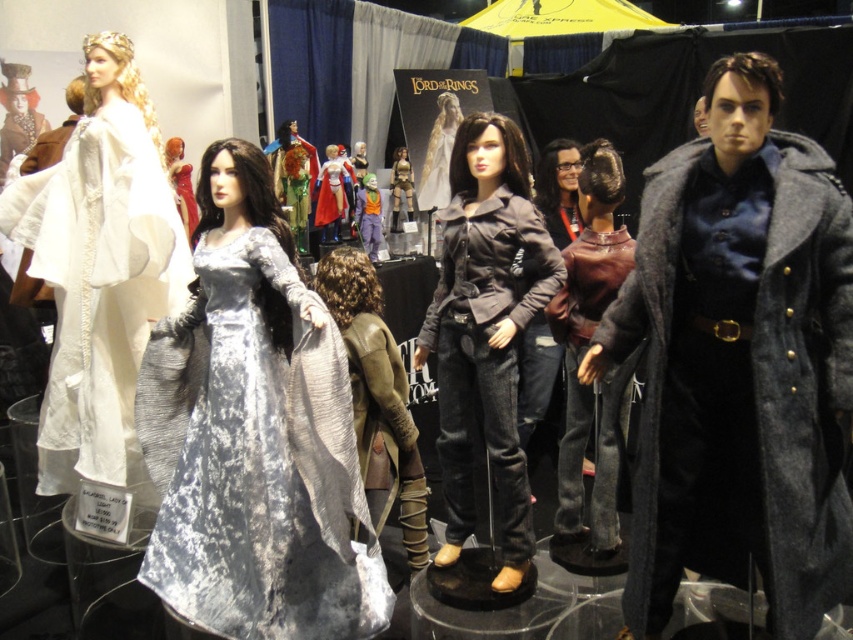
You are a GUI agent. You are given a task and a screenshot of the screen. Output one action in this format:
    pyautogui.click(x=<x>, y=<y>)
    Task: Click on the silver velvet gown at center
    
    Given the screenshot: What is the action you would take?
    pyautogui.click(x=254, y=460)

Which is below, silver velvet gown at center or shiny red dress at center?

silver velvet gown at center

I want to click on silver velvet gown at center, so click(x=254, y=460).

The image size is (853, 640). I want to click on silver velvet gown at center, so click(254, 460).

Which of these two, shiny red dress at center or metallic gold armor at center, stands taller?

With more height is metallic gold armor at center.

Does shiny red dress at center have a lesser height compared to metallic gold armor at center?

Yes, shiny red dress at center is shorter than metallic gold armor at center.

What do you see at coordinates (181, 182) in the screenshot? The height and width of the screenshot is (640, 853). I see `shiny red dress at center` at bounding box center [181, 182].

Where is `shiny red dress at center`? shiny red dress at center is located at coordinates (181, 182).

Is white lace dress at left bigger than silky white gown at center?

Yes.

Which is above, white lace dress at left or silky white gown at center?

silky white gown at center is higher up.

Does point (140, 266) come farther from viewer compared to point (444, 141)?

No, (140, 266) is in front of (444, 141).

Identify the location of white lace dress at left. (99, 291).